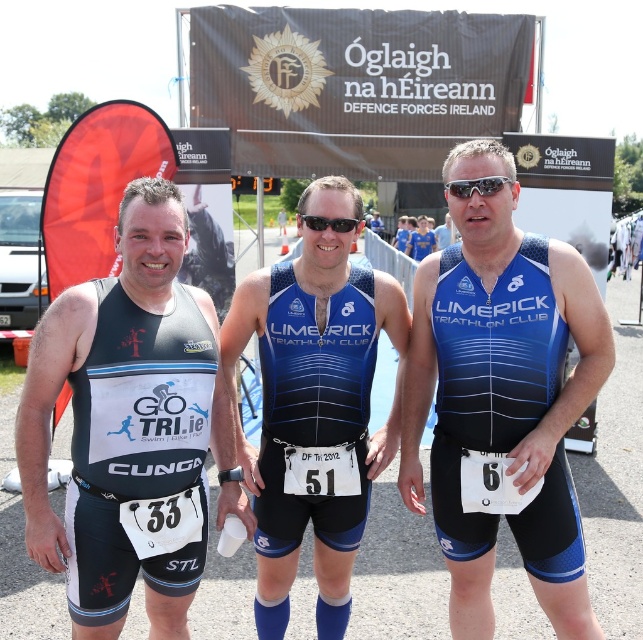
You are a photographer at the event and want to capture a photo of the blue matte triathlon suit at center without the sunglasses at center blocking it. What adjustment should you make to your camera angle?

The blue matte triathlon suit at center is positioned under the sunglasses at center, so you should angle your camera downward to avoid the sunglasses blocking the view of the suit.

You are a photographer standing at a distance. You want to capture a photo of the blue matte triathlon suit at center and sunglasses at center in the same frame. The minimum distance between these two objects to ensure both are in focus is 24 inches. Can you take the photo without moving?

The distance between the blue matte triathlon suit at center and sunglasses at center is 28.02 inches, which is greater than the minimum required 24 inches. Therefore, you can take the photo without moving as both will be in focus.